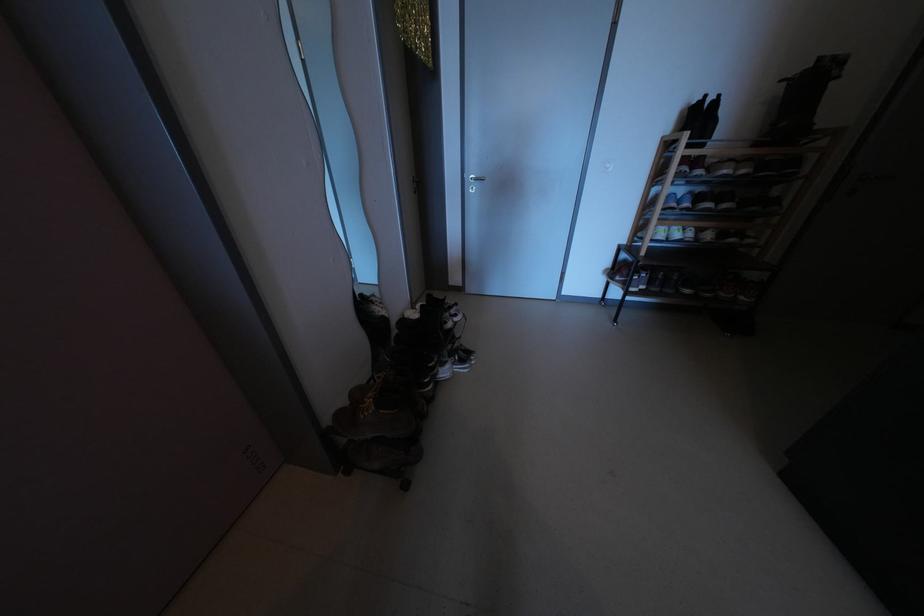
The location [384,456] corresponds to which object?

It corresponds to the brown hiking boot in the image.